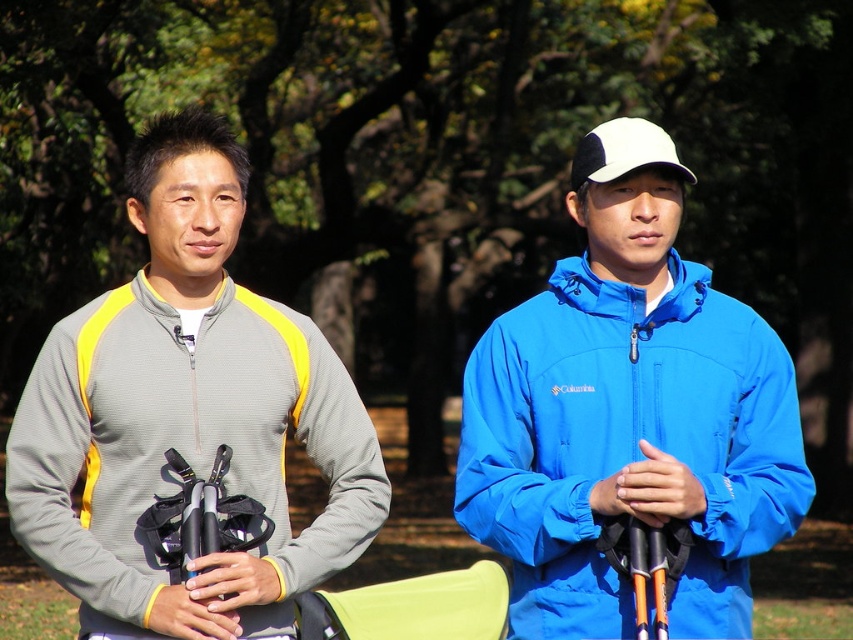
Question: Can you confirm if blue matte jacket at center is positioned to the left of gray fleece jacket at left?

Choices:
 (A) yes
 (B) no

Answer: (B)

Question: Which object appears closest to the camera in this image?

Choices:
 (A) blue matte jacket at center
 (B) gray fleece jacket at left

Answer: (A)

Question: Among these points, which one is farthest from the camera?

Choices:
 (A) (625, 241)
 (B) (199, 118)

Answer: (B)

Question: Can you confirm if blue matte jacket at center is smaller than gray fleece jacket at left?

Choices:
 (A) no
 (B) yes

Answer: (B)

Question: Does blue matte jacket at center appear under gray fleece jacket at left?

Choices:
 (A) no
 (B) yes

Answer: (A)